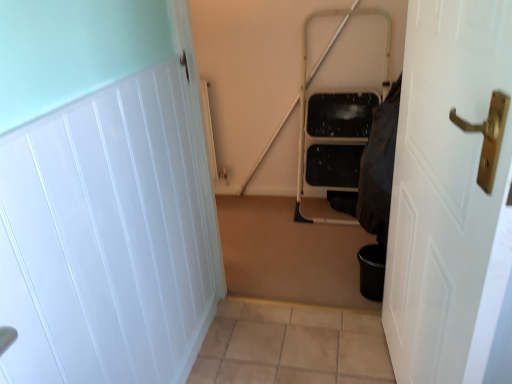
The image size is (512, 384). Find the location of `vacant point above white glossy door at left, marked as the 1th door in a left-to-right arrangement (from a real-world perspective)`. vacant point above white glossy door at left, marked as the 1th door in a left-to-right arrangement (from a real-world perspective) is located at coordinates (105, 82).